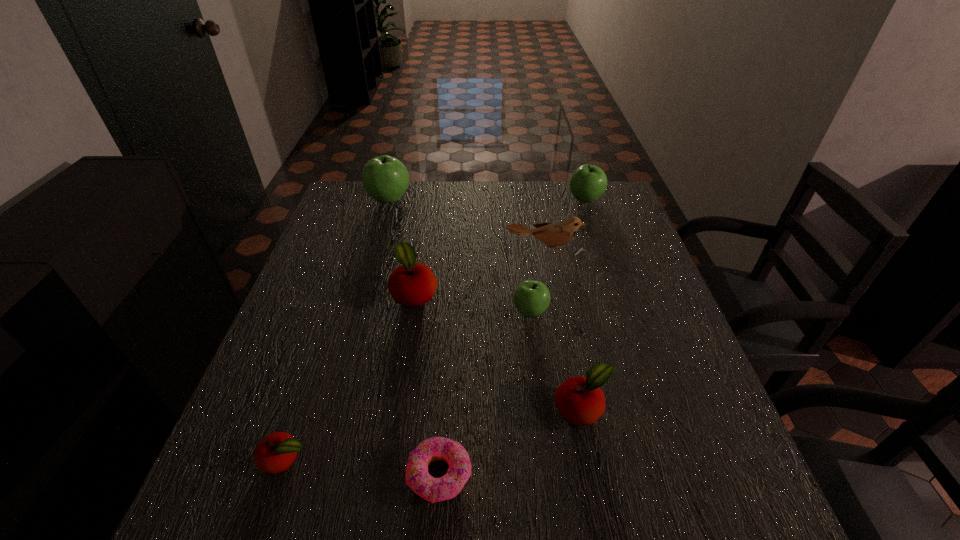
Image resolution: width=960 pixels, height=540 pixels. I want to click on the tallest apple, so click(385, 178).

The image size is (960, 540). What are the coordinates of `the biggest green apple` in the screenshot? It's located at (385, 178).

Where is `the rightmost green apple`? the rightmost green apple is located at coordinates (588, 183).

Locate an element on the screen. The width and height of the screenshot is (960, 540). the fifth shortest apple is located at coordinates (588, 183).

The height and width of the screenshot is (540, 960). I want to click on the third farthest object, so click(x=554, y=235).

The width and height of the screenshot is (960, 540). Find the location of `the biggest red apple`. the biggest red apple is located at coordinates (412, 284).

I want to click on the second red apple from right to left, so click(x=412, y=284).

This screenshot has height=540, width=960. I want to click on the second green apple from left to right, so click(x=531, y=298).

Find the location of a particular element. Image resolution: width=960 pixels, height=540 pixels. the nearest green apple is located at coordinates (531, 298).

Find the location of a particular element. This screenshot has width=960, height=540. the second nearest red apple is located at coordinates (580, 401).